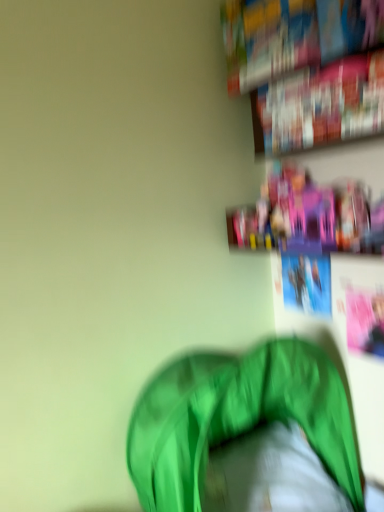
Question: Does point (289, 117) appear closer or farther from the camera than point (301, 60)?

Choices:
 (A) closer
 (B) farther

Answer: (B)

Question: In the image, is hardcover book at upper right, marked as the 2th book in a top-to-bottom arrangement, on the left side or the right side of hardcover book at upper right, which is the 2th book in bottom-to-top order?

Choices:
 (A) left
 (B) right

Answer: (B)

Question: Estimate the real-world distances between objects in this image. Which object is farther from the pink plastic toys at upper right?

Choices:
 (A) hardcover book at upper right, marked as the 2th book in a top-to-bottom arrangement
 (B) hardcover book at upper right, which is the 2th book in bottom-to-top order
 (C) green fabric bean bag at lower center

Answer: (C)

Question: Based on their relative distances, which object is farther from the pink plastic toys at upper right?

Choices:
 (A) green fabric bean bag at lower center
 (B) hardcover book at upper right, placed as the 1th book when sorted from top to bottom
 (C) hardcover book at upper right, the 1th book positioned from the bottom

Answer: (A)